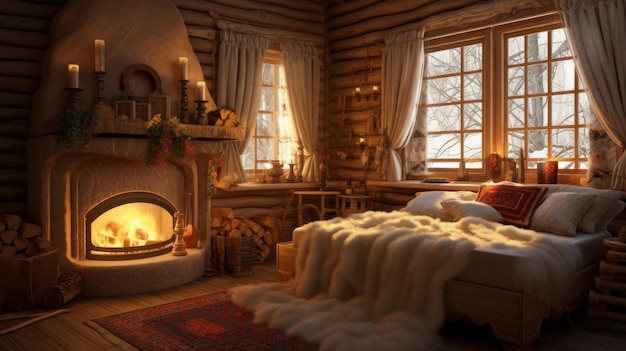
Where is `bed`? The image size is (626, 351). bed is located at coordinates (510, 275).